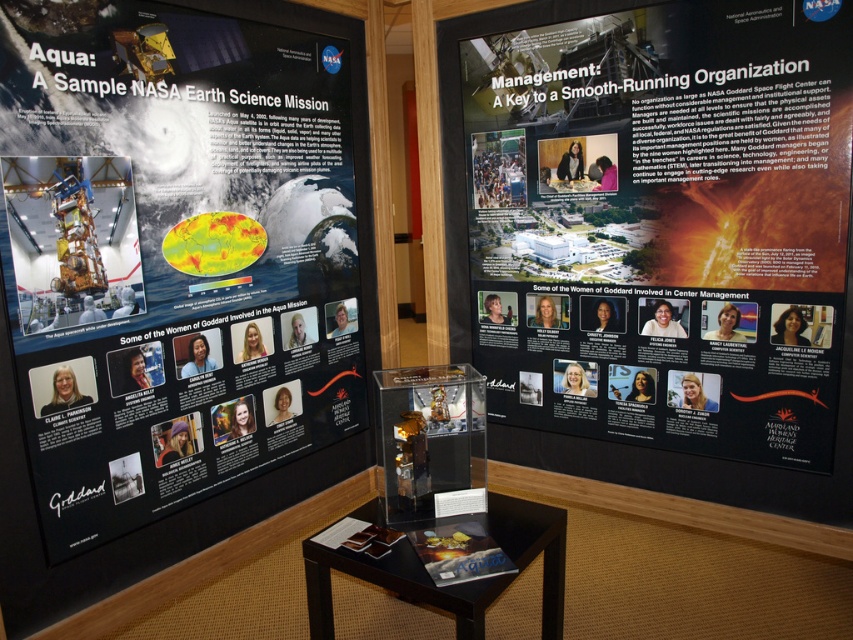
Looking at this image, you are an event coordinator setting up a NASA exhibit. You have two matte black posters to place on a wall. The matte black poster at left and the matte black poster at center. Which poster should you place higher on the wall to ensure they are both visible to visitors standing at eye level?

The matte black poster at left has a greater height compared to the matte black poster at center. To ensure visibility at eye level, place the taller matte black poster at left slightly lower so the shorter matte black poster at center can be positioned higher, balancing their visibility.

Based on the photo, you are standing in front of the NASA Aqua exhibit and see two matte black posters. Which poster, the matte black poster at left or the matte black poster at center, is closer to you?

The matte black poster at left is closer to the viewer than the matte black poster at center.

You are standing in the exhibition hall and want to locate the matte black poster at left. According to the coordinates provided, where exactly should you look?

The matte black poster at left is located at point coordinates (173,252).